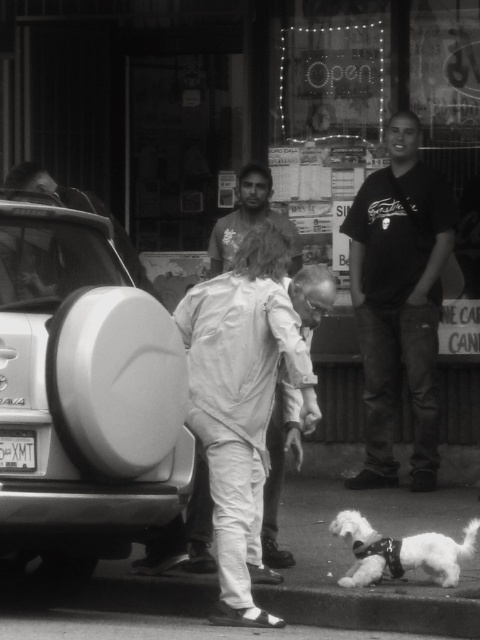
Question: Does dark cotton t-shirt at center appear on the left side of white soft fur dog at lower right?

Choices:
 (A) no
 (B) yes

Answer: (A)

Question: Which object is farther from the camera taking this photo?

Choices:
 (A) smooth skin man at center
 (B) white matte spare tire at left
 (C) dark cotton t-shirt at center
 (D) white soft fur dog at lower right

Answer: (C)

Question: Which object is the farthest from the black plastic license plate at lower left?

Choices:
 (A) white soft fur dog at lower right
 (B) white matte spare tire at left
 (C) smooth skin man at center

Answer: (C)

Question: Which point is farther to the camera?

Choices:
 (A) smooth skin man at center
 (B) white soft fur dog at lower right

Answer: (A)

Question: Can you confirm if dark cotton t-shirt at center is positioned below smooth skin man at center?

Choices:
 (A) yes
 (B) no

Answer: (A)

Question: Is white soft fur dog at lower right further to camera compared to black plastic license plate at lower left?

Choices:
 (A) yes
 (B) no

Answer: (A)